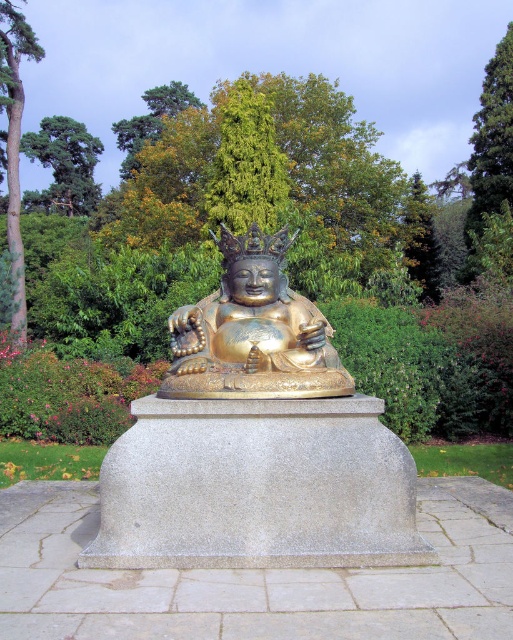
Can you confirm if gold polished statue at center is positioned above green leafy tree at upper right?

Actually, gold polished statue at center is below green leafy tree at upper right.

How distant is gold polished statue at center from green leafy tree at upper right?

A distance of 21.49 meters exists between gold polished statue at center and green leafy tree at upper right.

Is point (291, 339) closer to camera compared to point (491, 172)?

Yes, it is.

Locate an element on the screen. This screenshot has width=513, height=640. gold polished statue at center is located at coordinates (252, 332).

Does gold polished statue at center have a greater height compared to green leafy tree at upper left?

Incorrect, gold polished statue at center's height is not larger of green leafy tree at upper left's.

Does gold polished statue at center appear under green leafy tree at upper left?

Yes.

Which is in front, point (187, 337) or point (56, 168)?

Positioned in front is point (187, 337).

Locate an element on the screen. The height and width of the screenshot is (640, 513). gold polished statue at center is located at coordinates point(252,332).

Is point (17, 161) less distant than point (46, 163)?

Yes.

Find the location of a particular element. The width and height of the screenshot is (513, 640). brushed metal tree at left is located at coordinates (14, 141).

Is point (1, 76) closer to viewer compared to point (52, 129)?

Yes, point (1, 76) is in front of point (52, 129).

At what (x,y) coordinates should I click in order to perform the action: click on brushed metal tree at left. Please return your answer as a coordinate pair (x, y). This screenshot has width=513, height=640. Looking at the image, I should click on (14, 141).